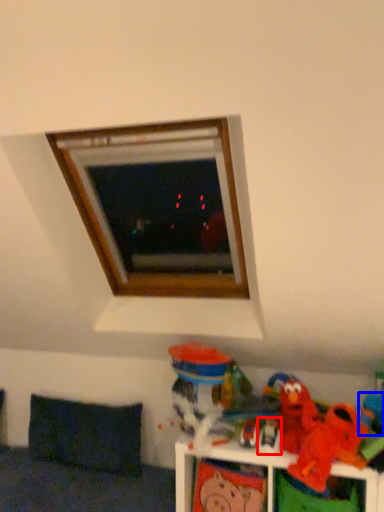
Question: Which object appears closest to the camera in this image, toy (highlighted by a red box) or toy (highlighted by a blue box)?

Choices:
 (A) toy
 (B) toy

Answer: (B)